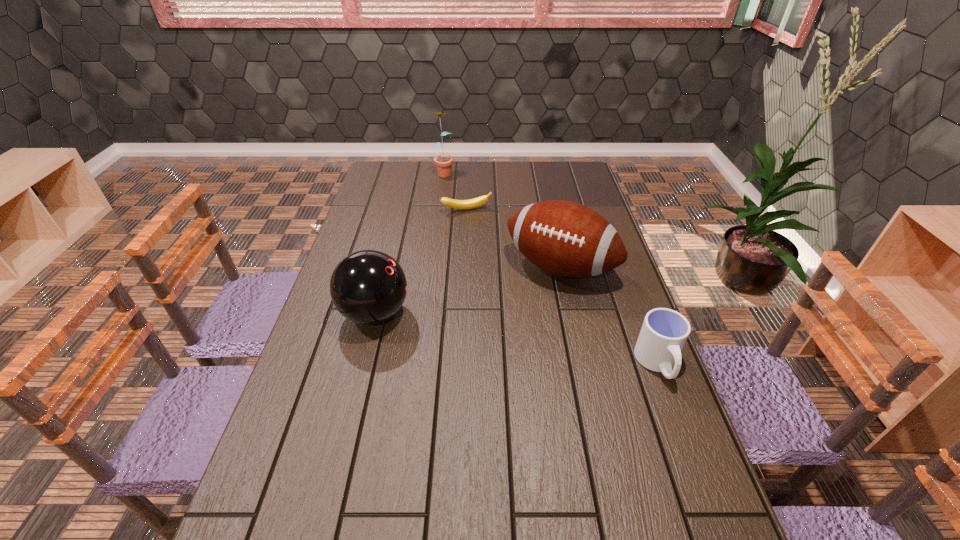
Find the location of a particular element. bowling ball is located at coordinates [x=368, y=287].

Where is `the second shortest object`? the second shortest object is located at coordinates (664, 332).

Locate an element on the screen. the nearest object is located at coordinates (664, 332).

You are a GUI agent. You are given a task and a screenshot of the screen. Output one action in this format:
    pyautogui.click(x=<x>, y=<y>)
    Task: Click on the banana
    
    Given the screenshot: What is the action you would take?
    pos(479,201)

Find the location of `the fourth nearest object`. the fourth nearest object is located at coordinates (479, 201).

The image size is (960, 540). I want to click on football, so click(564, 238).

Where is `sunflower`? The height and width of the screenshot is (540, 960). sunflower is located at coordinates (443, 163).

This screenshot has width=960, height=540. In order to click on free space located 0.100m on the surface of the bowling ball near the finger holes in this screenshot , I will do 445,314.

The image size is (960, 540). I want to click on free point located with the handle on the side of the cup, so click(x=713, y=510).

Image resolution: width=960 pixels, height=540 pixels. What are the coordinates of `vacant space located 0.240m at the stem of the second farthest object` in the screenshot? It's located at (492, 252).